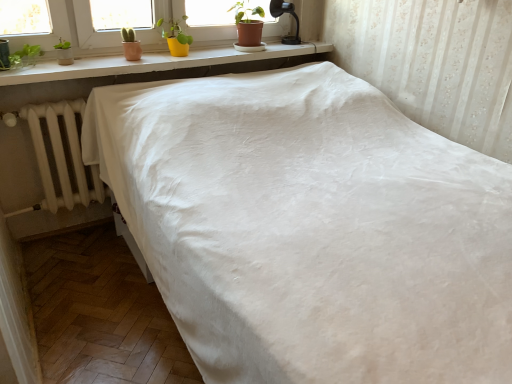
You are a GUI agent. You are given a task and a screenshot of the screen. Output one action in this format:
    pyautogui.click(x=<x>, y=<y>)
    Task: Click on the unoccupied area behind black glass lamp at upper right
    The image size is (512, 384).
    Given the screenshot: What is the action you would take?
    pyautogui.click(x=288, y=40)